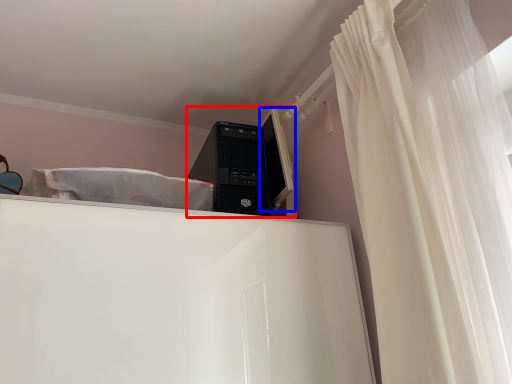
Question: Which object appears farthest to the camera in this image, desktop computer (highlighted by a red box) or computer monitor (highlighted by a blue box)?

Choices:
 (A) desktop computer
 (B) computer monitor

Answer: (B)